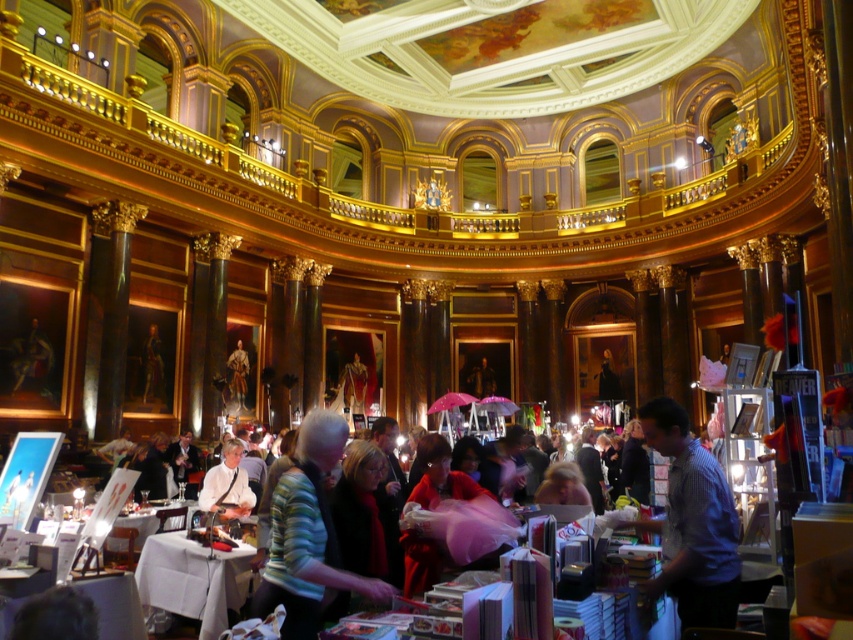
Is striped sweater at center bigger than white cloth-covered table at center?

Indeed, striped sweater at center has a larger size compared to white cloth-covered table at center.

Is striped sweater at center wider than white cloth-covered table at center?

Yes.

Find the location of a particular element. Image resolution: width=853 pixels, height=640 pixels. striped sweater at center is located at coordinates (308, 536).

Between red satin dress at center and light blue shirt at center, which one is positioned higher?

red satin dress at center is higher up.

From the picture: Who is more distant from viewer, (x=434, y=438) or (x=231, y=438)?

The point (x=231, y=438) is behind.

In order to click on red satin dress at center in this screenshot , I will do `click(440, 476)`.

I want to click on red satin dress at center, so click(x=440, y=476).

Is blue checkered shirt at center shorter than light blue shirt at center?

No, blue checkered shirt at center is not shorter than light blue shirt at center.

Can you confirm if blue checkered shirt at center is wider than light blue shirt at center?

In fact, blue checkered shirt at center might be narrower than light blue shirt at center.

This screenshot has width=853, height=640. Find the location of `blue checkered shirt at center`. blue checkered shirt at center is located at coordinates (692, 524).